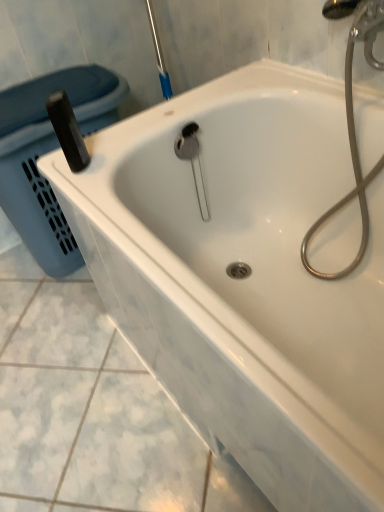
Measure the distance between metallic silver hose at upper right and camera.

metallic silver hose at upper right is 32.56 inches away from camera.

What is the approximate height of metallic silver hose at upper right?

metallic silver hose at upper right is 25.74 inches in height.

At what (x,y) coordinates should I click in order to perform the action: click on metallic silver hose at upper right. Please return your answer as a coordinate pair (x, y). Image resolution: width=384 pixels, height=512 pixels. Looking at the image, I should click on (352, 119).

Image resolution: width=384 pixels, height=512 pixels. What do you see at coordinates (352, 119) in the screenshot? I see `metallic silver hose at upper right` at bounding box center [352, 119].

Image resolution: width=384 pixels, height=512 pixels. What do you see at coordinates (47, 152) in the screenshot?
I see `blue plastic laundry basket at left` at bounding box center [47, 152].

In order to face blue plastic laundry basket at left, should I rotate leftwards or rightwards?

It's best to rotate left around 16.803 degrees.

This screenshot has height=512, width=384. What are the coordinates of `blue plastic laundry basket at left` in the screenshot? It's located at click(x=47, y=152).

Locate an element on the screen. metallic silver hose at upper right is located at coordinates (352, 119).

In the image, is metallic silver hose at upper right on the left side or the right side of blue plastic laundry basket at left?

In the image, metallic silver hose at upper right appears on the right side of blue plastic laundry basket at left.

Does metallic silver hose at upper right lie in front of blue plastic laundry basket at left?

Yes, it is in front of blue plastic laundry basket at left.

Does point (355, 180) come in front of point (16, 209)?

Yes, point (355, 180) is in front of point (16, 209).

From the image's perspective, is metallic silver hose at upper right below blue plastic laundry basket at left?

Correct, metallic silver hose at upper right appears lower than blue plastic laundry basket at left in the image.

From a real-world perspective, which object stands above the other?

metallic silver hose at upper right is physically above.

Based on the photo, can you confirm if metallic silver hose at upper right is wider than blue plastic laundry basket at left?

In fact, metallic silver hose at upper right might be narrower than blue plastic laundry basket at left.

In the scene shown: Who is taller, metallic silver hose at upper right or blue plastic laundry basket at left?

With more height is metallic silver hose at upper right.

Considering the sizes of objects metallic silver hose at upper right and blue plastic laundry basket at left in the image provided, who is smaller, metallic silver hose at upper right or blue plastic laundry basket at left?

With smaller size is metallic silver hose at upper right.

Is blue plastic laundry basket at left completely or partially inside metallic silver hose at upper right?

No.

Are metallic silver hose at upper right and blue plastic laundry basket at left located far from each other?

metallic silver hose at upper right is actually quite close to blue plastic laundry basket at left.

Is metallic silver hose at upper right facing away from blue plastic laundry basket at left?

metallic silver hose at upper right is not turned away from blue plastic laundry basket at left.

What's the angular difference between metallic silver hose at upper right and blue plastic laundry basket at left's facing directions?

The facing directions of metallic silver hose at upper right and blue plastic laundry basket at left are 85.1 degrees apart.

Find the location of a particular element. This screenshot has width=384, height=512. laundry basket behind the metallic silver hose at upper right is located at coordinates (47, 152).

Which object is positioned more to the left, blue plastic laundry basket at left or metallic silver hose at upper right?

blue plastic laundry basket at left is more to the left.

Is blue plastic laundry basket at left positioned behind metallic silver hose at upper right?

Yes, it is behind metallic silver hose at upper right.

Is point (17, 116) closer or farther from the camera than point (345, 70)?

Clearly, point (17, 116) is more distant from the camera than point (345, 70).

From the image's perspective, which one is positioned lower, blue plastic laundry basket at left or metallic silver hose at upper right?

From the image's view, metallic silver hose at upper right is below.

From a real-world perspective, is blue plastic laundry basket at left located beneath metallic silver hose at upper right?

Yes, from a real-world perspective, blue plastic laundry basket at left is beneath metallic silver hose at upper right.

Which of these two, blue plastic laundry basket at left or metallic silver hose at upper right, is wider?

blue plastic laundry basket at left is wider.

Who is taller, blue plastic laundry basket at left or metallic silver hose at upper right?

metallic silver hose at upper right.

Considering the relative sizes of blue plastic laundry basket at left and metallic silver hose at upper right in the image provided, is blue plastic laundry basket at left bigger than metallic silver hose at upper right?

Yes, blue plastic laundry basket at left is bigger than metallic silver hose at upper right.

In the scene shown: Is blue plastic laundry basket at left not inside metallic silver hose at upper right?

Yes, blue plastic laundry basket at left is not within metallic silver hose at upper right.

Would you say blue plastic laundry basket at left is a long distance from metallic silver hose at upper right?

No, blue plastic laundry basket at left is in close proximity to metallic silver hose at upper right.

Consider the image. Is blue plastic laundry basket at left looking in the opposite direction of metallic silver hose at upper right?

No, blue plastic laundry basket at left's orientation is not away from metallic silver hose at upper right.

What's the angular difference between blue plastic laundry basket at left and metallic silver hose at upper right's facing directions?

85.1 degrees.

Find the location of a particular element. The image size is (384, 512). plumbing fixture lying below the blue plastic laundry basket at left (from the image's perspective) is located at coordinates (352, 119).

Where is `laundry basket on the left of metallic silver hose at upper right`? This screenshot has width=384, height=512. laundry basket on the left of metallic silver hose at upper right is located at coordinates (47, 152).

The width and height of the screenshot is (384, 512). Find the location of `laundry basket above the metallic silver hose at upper right (from the image's perspective)`. laundry basket above the metallic silver hose at upper right (from the image's perspective) is located at coordinates (47, 152).